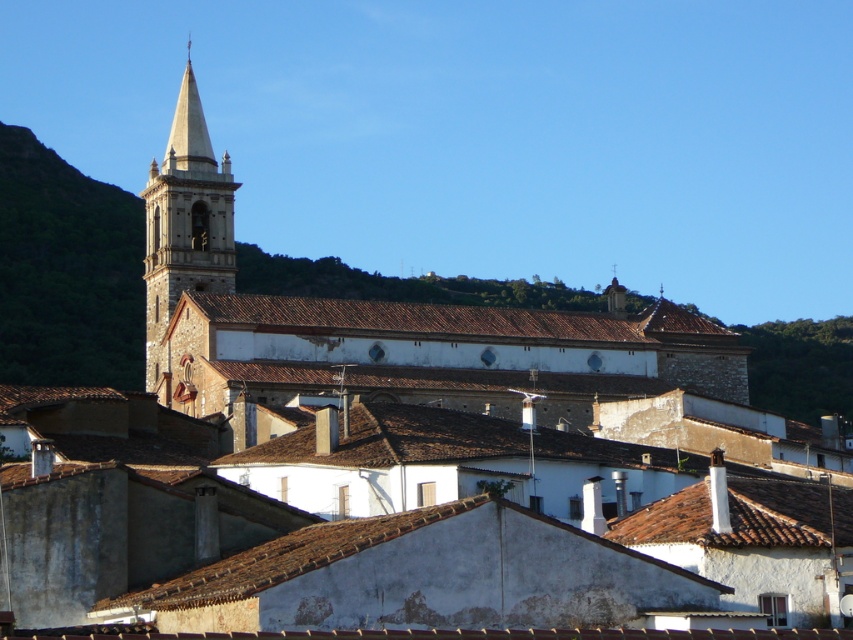
Question: Which object is farther from the camera taking this photo?

Choices:
 (A) brown stone church at center
 (B) stone steeple at upper left

Answer: (B)

Question: Can you confirm if brown stone church at center is positioned below stone steeple at upper left?

Choices:
 (A) yes
 (B) no

Answer: (A)

Question: Which of the following is the farthest from the observer?

Choices:
 (A) (161, 208)
 (B) (601, 340)

Answer: (A)

Question: Is brown stone church at center closer to camera compared to stone steeple at upper left?

Choices:
 (A) yes
 (B) no

Answer: (A)

Question: Is brown stone church at center above stone steeple at upper left?

Choices:
 (A) yes
 (B) no

Answer: (B)